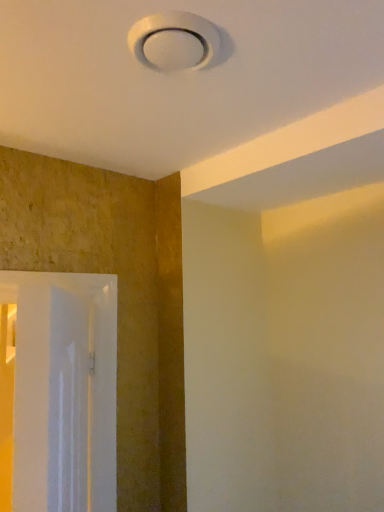
Where is `white glossy door at left`? The width and height of the screenshot is (384, 512). white glossy door at left is located at coordinates (60, 390).

This screenshot has width=384, height=512. What do you see at coordinates (60, 390) in the screenshot? I see `white glossy door at left` at bounding box center [60, 390].

You are a GUI agent. You are given a task and a screenshot of the screen. Output one action in this format:
    pyautogui.click(x=<x>, y=<y>)
    Task: Click on the white plastic lamp at upper center
    The image size is (384, 512).
    Given the screenshot: What is the action you would take?
    pyautogui.click(x=174, y=41)

Image resolution: width=384 pixels, height=512 pixels. Describe the element at coordinates (174, 41) in the screenshot. I see `white plastic lamp at upper center` at that location.

Find the location of a particular element. This screenshot has height=512, width=384. white glossy door at left is located at coordinates (60, 390).

Considering the positions of objects white glossy door at left and white plastic lamp at upper center in the image provided, who is more to the left, white glossy door at left or white plastic lamp at upper center?

white glossy door at left is more to the left.

Which is in front, white glossy door at left or white plastic lamp at upper center?

white plastic lamp at upper center is more forward.

Is point (53, 440) closer to camera compared to point (159, 40)?

Yes, point (53, 440) is in front of point (159, 40).

From the image's perspective, between white glossy door at left and white plastic lamp at upper center, who is located below?

white glossy door at left, from the image's perspective.

Based on the photo, from a real-world perspective, is white glossy door at left physically located above or below white plastic lamp at upper center?

From a real-world perspective, white glossy door at left is physically below white plastic lamp at upper center.

In terms of width, does white glossy door at left look wider or thinner when compared to white plastic lamp at upper center?

Considering their sizes, white glossy door at left looks slimmer than white plastic lamp at upper center.

Between white glossy door at left and white plastic lamp at upper center, which one has less height?

white plastic lamp at upper center.

Can you confirm if white glossy door at left is bigger than white plastic lamp at upper center?

Yes.

Which is correct: white glossy door at left is inside white plastic lamp at upper center, or outside of it?

white glossy door at left is outside white plastic lamp at upper center.

Are white glossy door at left and white plastic lamp at upper center beside each other?

No, white glossy door at left is not touching white plastic lamp at upper center.

Could you tell me if white glossy door at left is turned towards white plastic lamp at upper center?

Yes, white glossy door at left is oriented towards white plastic lamp at upper center.

Identify the location of screen door behind the white plastic lamp at upper center. The image size is (384, 512). (60, 390).

Which object is positioned more to the right, white plastic lamp at upper center or white glossy door at left?

white plastic lamp at upper center.

Relative to white glossy door at left, is white plastic lamp at upper center in front or behind?

white plastic lamp at upper center is in front of white glossy door at left.

Is point (137, 47) positioned in front of point (75, 351)?

Yes.

From the image's perspective, does white plastic lamp at upper center appear lower than white glossy door at left?

No.

From a real-world perspective, is white plastic lamp at upper center physically located above or below white glossy door at left?

Clearly, from a real-world perspective, white plastic lamp at upper center is above white glossy door at left.

Between white plastic lamp at upper center and white glossy door at left, which one has smaller width?

Thinner between the two is white glossy door at left.

Is white plastic lamp at upper center shorter than white glossy door at left?

Correct, white plastic lamp at upper center is not as tall as white glossy door at left.

Considering the sizes of white plastic lamp at upper center and white glossy door at left in the image, is white plastic lamp at upper center bigger or smaller than white glossy door at left?

white plastic lamp at upper center is smaller than white glossy door at left.

Is white glossy door at left completely or partially inside white plastic lamp at upper center?

No, white glossy door at left is not surrounded by white plastic lamp at upper center.

Consider the image. Are white plastic lamp at upper center and white glossy door at left located far from each other?

No, white plastic lamp at upper center is not far from white glossy door at left.

Is white plastic lamp at upper center facing towards white glossy door at left?

No, white plastic lamp at upper center is not oriented towards white glossy door at left.

What's the angular difference between white plastic lamp at upper center and white glossy door at left's facing directions?

91.5 degrees.

Locate an element on the screen. screen door behind the white plastic lamp at upper center is located at coordinates (60, 390).

Locate an element on the screen. lamp that is above the white glossy door at left (from the image's perspective) is located at coordinates (174, 41).

The width and height of the screenshot is (384, 512). In the image, there is a white plastic lamp at upper center. Find the location of `screen door below it (from a real-world perspective)`. screen door below it (from a real-world perspective) is located at coordinates (60, 390).